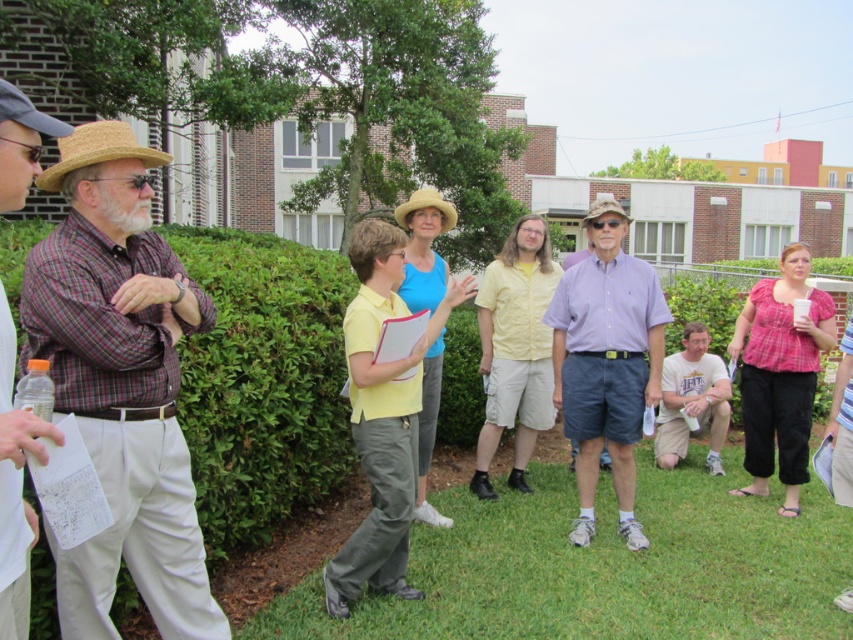
What is the color of the shirt worn by the person located at point coordinates (842,422)?

The striped cotton shirt at center is the color of the shirt worn by the person located at point coordinates (842,422).

You are standing at the position of the man in the plaid cotton shirt at left. You want to hand a document to the person wearing the light yellow straw hat at center. Can you reach them without moving from your current position? Explain your reasoning.

The plaid cotton shirt at left is 2.91 meters away from the light yellow straw hat at center. Since the average human arm length is about 0.7 meters, you cannot reach them without moving closer.

You are a photographer trying to capture a group photo of the striped cotton shirt at center and the straw hat at upper left. Which object should you focus on first if you want to include both in the frame without moving the camera?

The striped cotton shirt at center is taller than the straw hat at upper left, so you should focus on the striped cotton shirt at center first to ensure it fits within the frame.